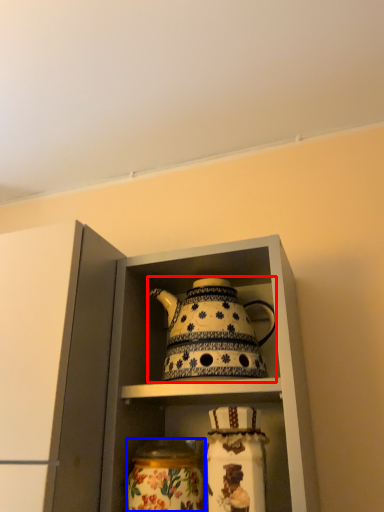
Question: Which of the following is the farthest to the observer, kettle (highlighted by a red box) or glass vase (highlighted by a blue box)?

Choices:
 (A) kettle
 (B) glass vase

Answer: (A)